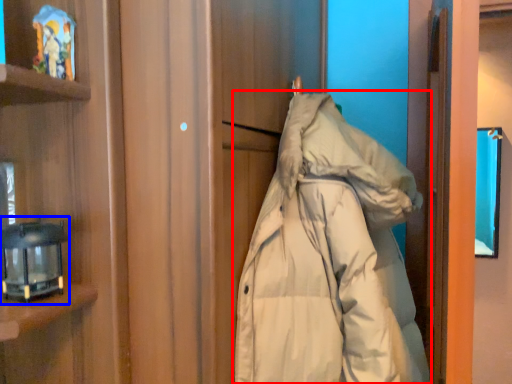
Question: Which object is further to the camera taking this photo, jacket (highlighted by a red box) or lamp (highlighted by a blue box)?

Choices:
 (A) jacket
 (B) lamp

Answer: (B)